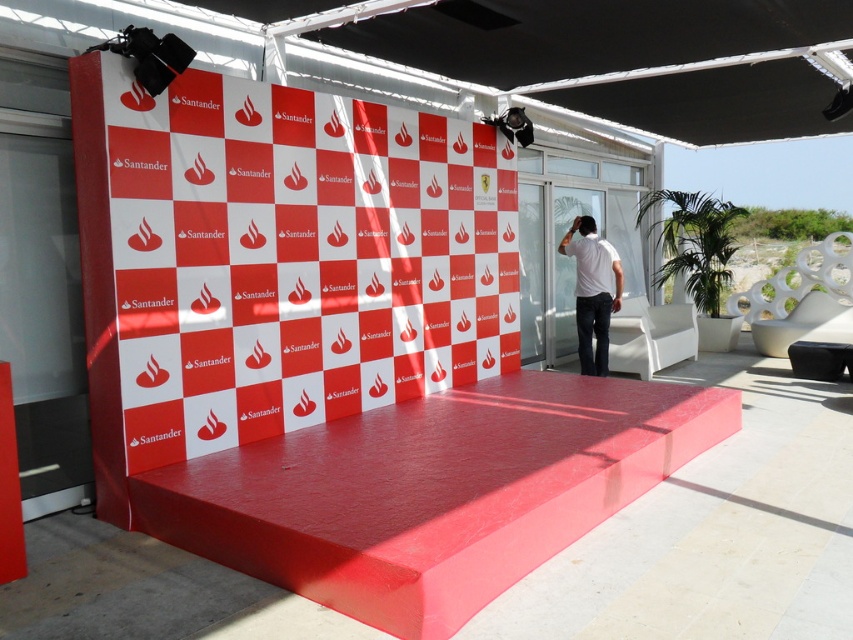
You are an event planner looking at the stage setup. You need to decide where to place a tall banner. The banner requires a surface that is taller than the other. Which object should you choose between the smooth red ramp at center and the matte white canopy at upper center?

The smooth red ramp at center is much taller than the matte white canopy at upper center, so you should choose the smooth red ramp at center to place the tall banner.

You are planning to install a new lighting system for the outdoor event. The lighting system requires a mounting point that is wider than the white matte shirt at center. Can the matte white canopy at upper center provide a suitable mounting point for this system?

The matte white canopy at upper center might be wider than the white matte shirt at center, so it could potentially provide a suitable mounting point for the lighting system.

You are planning to place a decorative flag on the smooth red ramp at center. The flag requires a flagpole that is 1.2 meters long. Given the ramp is at point coordinates, can you determine if the flagpole will fit on the ramp?

The smooth red ramp at center is located at coordinates point (432, 492), but without knowing the ramp dimensions, it is impossible to determine if the flagpole will fit. Please provide more information about the ramp size.